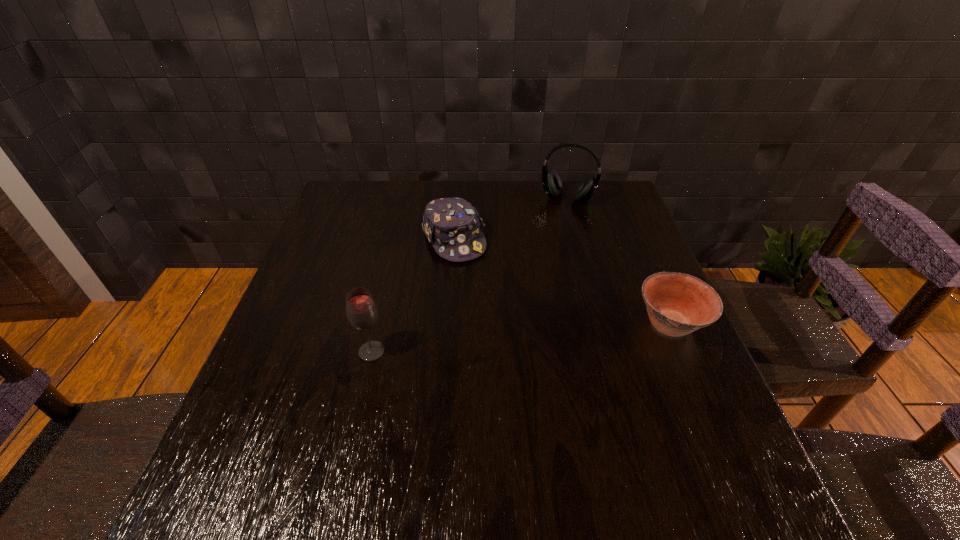
Where is `vacant space at the left edge`? vacant space at the left edge is located at coordinates (331, 368).

Where is `vacant area at the right edge of the desktop`? This screenshot has width=960, height=540. vacant area at the right edge of the desktop is located at coordinates (633, 389).

In the image, there is a desktop. Identify the location of free space at the far left corner. (363, 216).

Identify the location of vacant space at the far right corner of the desktop. This screenshot has width=960, height=540. (608, 190).

Locate an element on the screen. The width and height of the screenshot is (960, 540). vacant space in between the farthest object and the third nearest object is located at coordinates (511, 219).

This screenshot has height=540, width=960. In order to click on unoccupied position between the glass drink container and the bowl in this screenshot , I will do `click(521, 338)`.

Locate an element on the screen. free space between the glass drink container and the bowl is located at coordinates (521, 338).

At what (x,y) coordinates should I click in order to perform the action: click on free space between the farthest object and the glass drink container. Please return your answer as a coordinate pair (x, y). This screenshot has width=960, height=540. Looking at the image, I should click on (469, 275).

Identify the location of vacant area between the bowl and the third object from right to left. (563, 282).

The height and width of the screenshot is (540, 960). I want to click on vacant space that is in between the second farthest object and the leftmost object, so click(413, 296).